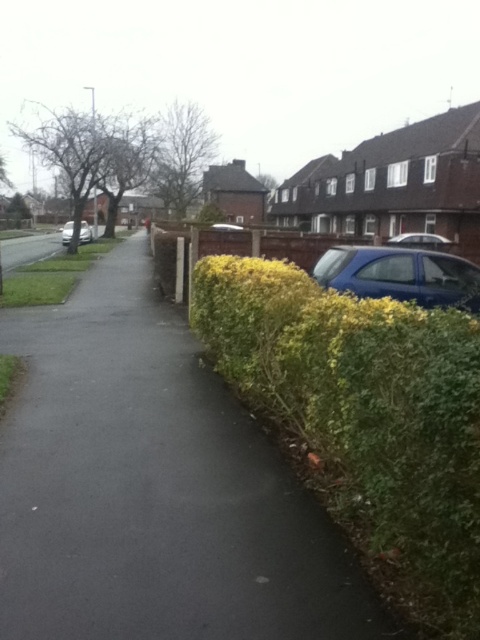
Can you confirm if black asphalt pavement at center is thinner than matte black car at center?

Yes, black asphalt pavement at center is thinner than matte black car at center.

Does black asphalt pavement at center have a greater height compared to matte black car at center?

No, black asphalt pavement at center is not taller than matte black car at center.

Find the location of a particular element. The image size is (480, 640). black asphalt pavement at center is located at coordinates (154, 486).

Which of these two, green leafy hedge at center or matte black car at center, stands taller?

With more height is matte black car at center.

Is green leafy hedge at center wider than matte black car at center?

In fact, green leafy hedge at center might be narrower than matte black car at center.

Where is `green leafy hedge at center`? green leafy hedge at center is located at coordinates (365, 413).

Is the position of blue matte car at right less distant than that of matte black car at center?

Yes, blue matte car at right is in front of matte black car at center.

Is blue matte car at right thinner than matte black car at center?

Yes, blue matte car at right is thinner than matte black car at center.

Who is more distant from viewer, (451, 276) or (66, 243)?

Point (66, 243)

What are the coordinates of `blue matte car at right` in the screenshot? It's located at (400, 275).